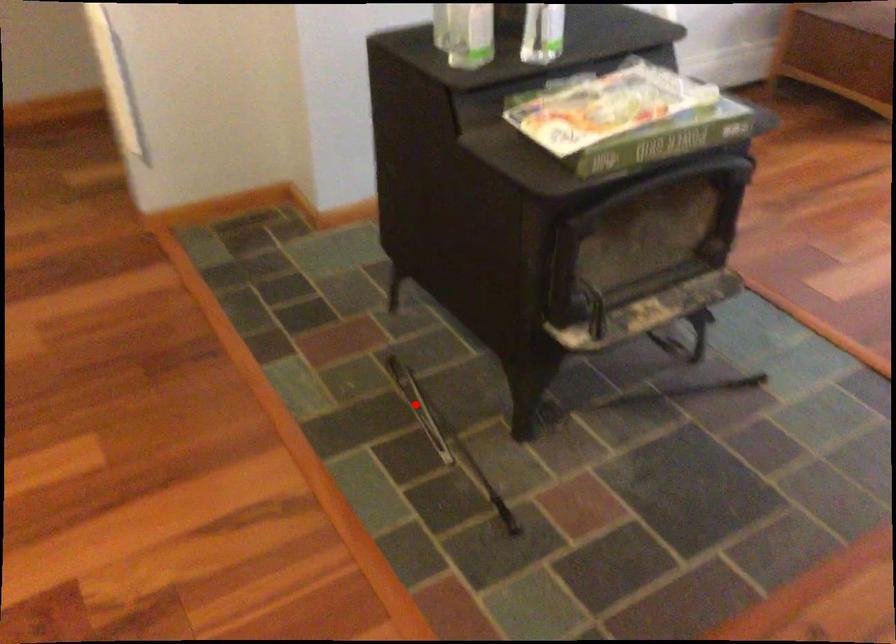
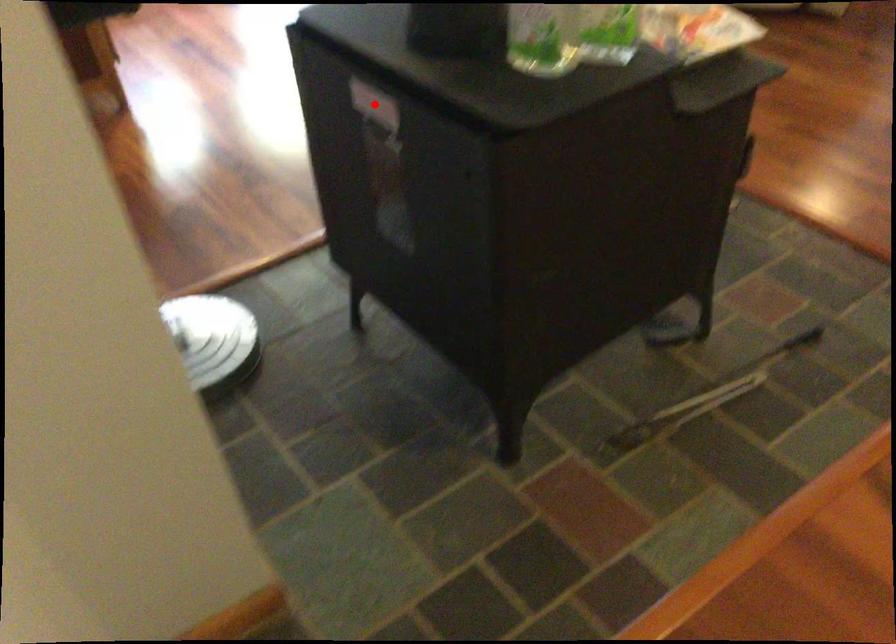
I am providing you with two images of the same scene from different viewpoints. A red point is marked on the first image and another point is marked on the second image. Do the highlighted points in image1 and image2 indicate the same real-world spot?

No